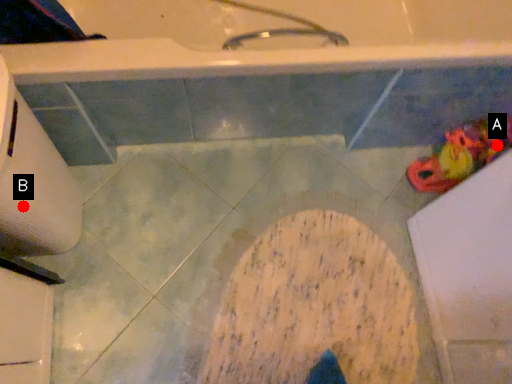
Question: Two points are circled on the image, labeled by A and B beside each circle. Among these points, which one is nearest to the camera?

Choices:
 (A) A is closer
 (B) B is closer

Answer: (B)